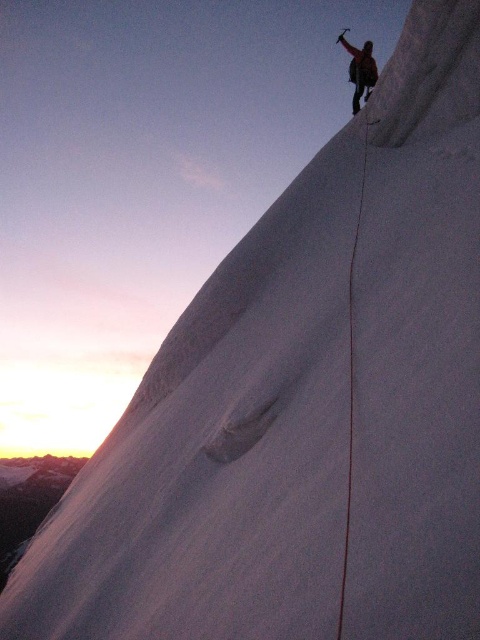
You are an ice climber assessing the slope. You notice the smooth ice crack at upper right and the dark brown leather jacket at upper right. Which object is positioned closer to your current viewpoint?

The smooth ice crack at upper right is closer to the viewer than the dark brown leather jacket at upper right, so the smooth ice crack is closer.

You are an ice climber assessing the slope. You notice the smooth ice crack at upper right and the dark brown leather jacket at upper right. Which object is located to the left when viewed from your perspective?

The smooth ice crack at upper right is positioned on the left side of dark brown leather jacket at upper right, so it is located to the left when viewed from your perspective.

You are a climber trying to reach the summit. You see two points marked on your map. The first point is at coordinate point [339,600] and the second is at point [361,61]. Which point is closer to your current position if you are standing at the base of the slope?

Point [339,600] is in front of point [361,61], so it is closer to your current position at the base of the slope.